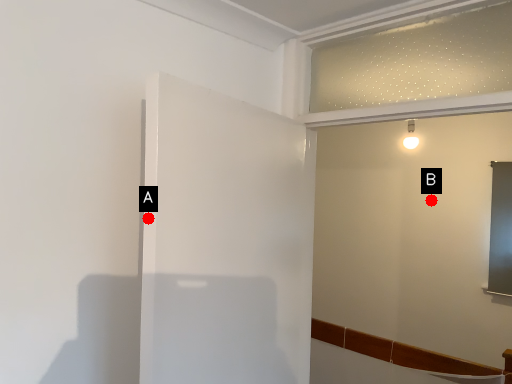
Question: Two points are circled on the image, labeled by A and B beside each circle. Which point is farther to the camera?

Choices:
 (A) A is further
 (B) B is further

Answer: (B)